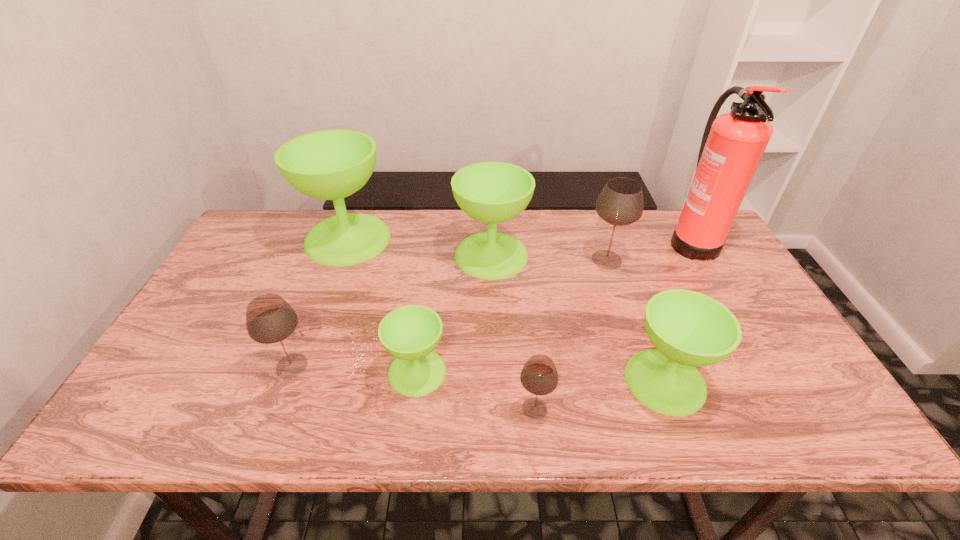
This screenshot has width=960, height=540. What are the coordinates of `the smallest green wineglass` in the screenshot? It's located at (410, 333).

At what (x,y) coordinates should I click in order to perform the action: click on the third wineglass from left to right. Please return your answer as a coordinate pair (x, y). Image resolution: width=960 pixels, height=540 pixels. Looking at the image, I should click on (410, 333).

Locate an element on the screen. This screenshot has width=960, height=540. the second gray wineglass from right to left is located at coordinates (539, 376).

The height and width of the screenshot is (540, 960). Identify the location of the nearest gray wineglass. (539, 376).

This screenshot has height=540, width=960. In order to click on free region located at the nozzle of the tallest object in this screenshot , I will do `click(552, 240)`.

This screenshot has width=960, height=540. I want to click on vacant space situated 0.390m at the nozzle of the tallest object, so click(546, 240).

Identify the location of vacant space situated at the nozzle of the tallest object. The image size is (960, 540). (646, 240).

Where is `free space located 0.100m on the front of the tallest wineglass`? The height and width of the screenshot is (540, 960). free space located 0.100m on the front of the tallest wineglass is located at coordinates (329, 290).

This screenshot has height=540, width=960. Identify the location of free point located on the left of the second biggest green wineglass. (344, 255).

Image resolution: width=960 pixels, height=540 pixels. Identify the location of vacant space located on the left of the farthest gray wineglass. (470, 260).